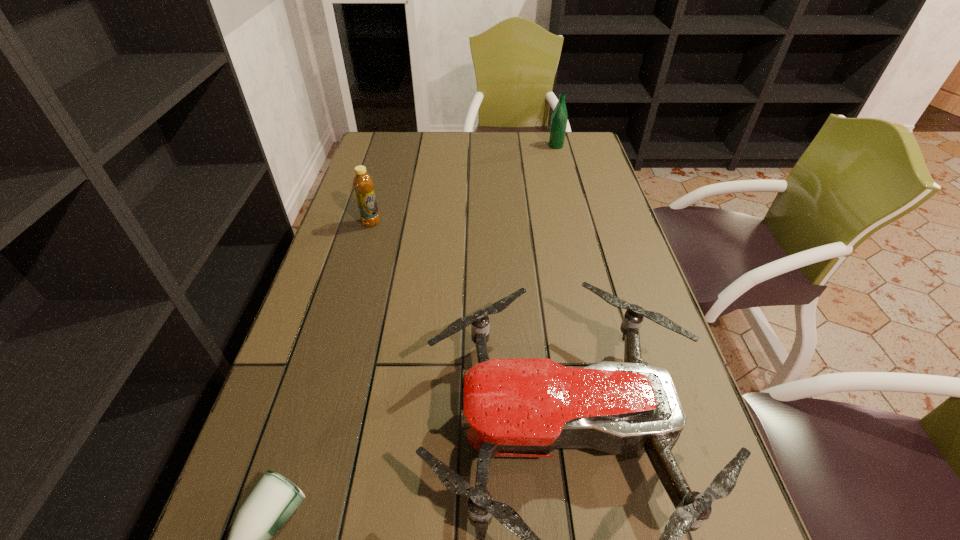
At what (x,y) coordinates should I click in order to perform the action: click on the farthest bottle. Please return your answer as a coordinate pair (x, y). Looking at the image, I should click on (559, 118).

Image resolution: width=960 pixels, height=540 pixels. In order to click on the farthest object in this screenshot , I will do `click(559, 118)`.

This screenshot has height=540, width=960. I want to click on the second farthest bottle, so click(363, 184).

Image resolution: width=960 pixels, height=540 pixels. What are the coordinates of `vacant point located on the left of the farthest object` in the screenshot? It's located at (489, 146).

I want to click on free space located on the right of the third nearest object, so click(495, 222).

Locate an element on the screen. This screenshot has width=960, height=540. object that is positioned at the far edge is located at coordinates (559, 118).

This screenshot has width=960, height=540. I want to click on object located at the left edge, so click(x=363, y=184).

Find the location of a particular element. object located at the right edge is located at coordinates (559, 118).

At what (x,y) coordinates should I click in order to perform the action: click on object that is at the far right corner. Please return your answer as a coordinate pair (x, y). Image resolution: width=960 pixels, height=540 pixels. Looking at the image, I should click on (559, 118).

Locate an element on the screen. The height and width of the screenshot is (540, 960). vacant space at the far edge is located at coordinates (462, 138).